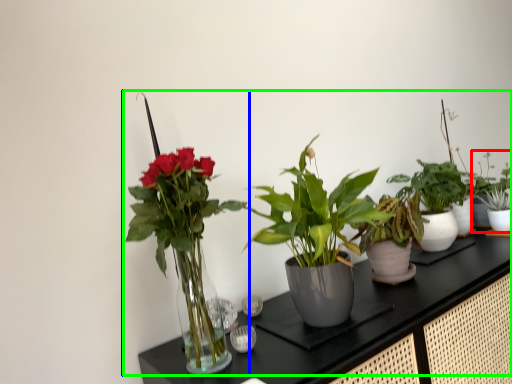
Question: Which object is positioned closest to houseplant (highlighted by a red box)? Select from houseplant (highlighted by a blue box) and houseplant (highlighted by a green box).

Choices:
 (A) houseplant
 (B) houseplant

Answer: (B)